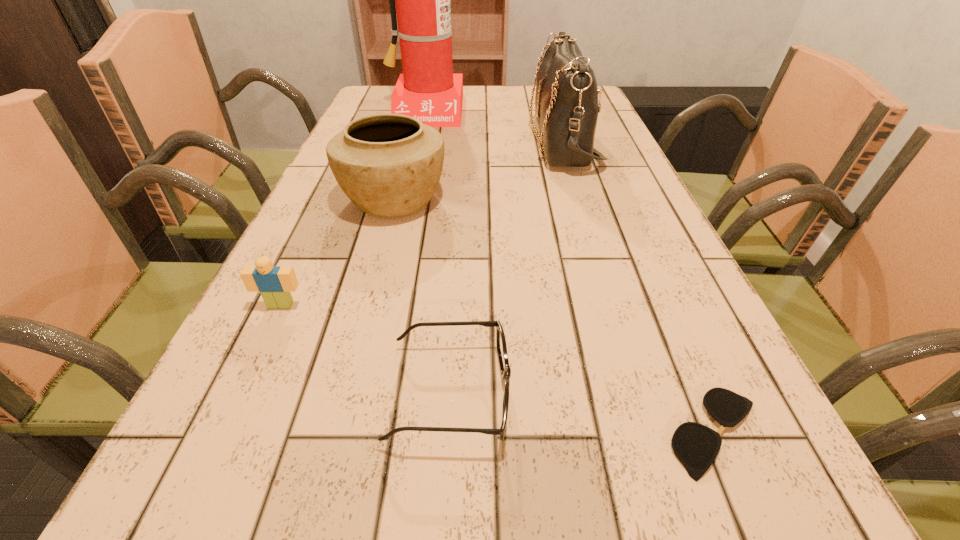
What are the coordinates of `free space located 0.350m at the front of the handbag with chain and zipper` in the screenshot? It's located at (402, 143).

Identify the location of free space located 0.380m at the front of the handbag with chain and zipper. (391, 143).

The width and height of the screenshot is (960, 540). What are the coordinates of `blank area located at the front of the handbag with chain and zipper` in the screenshot? It's located at (432, 143).

The width and height of the screenshot is (960, 540). I want to click on free space located 0.350m on the front of the pottery, so click(348, 372).

This screenshot has width=960, height=540. Identify the location of vacant space situated on the face of the Lego. (182, 515).

Image resolution: width=960 pixels, height=540 pixels. I want to click on free region located on the front-facing side of the left spectacles, so click(732, 393).

Locate an element on the screen. The image size is (960, 540). blank space located on the left of the shorter spectacles is located at coordinates (419, 433).

Image resolution: width=960 pixels, height=540 pixels. Identify the location of fire extinguisher at the far edge. (427, 90).

Where is `handbag that is positioned at the far edge`? The width and height of the screenshot is (960, 540). handbag that is positioned at the far edge is located at coordinates (566, 100).

At what (x,y) coordinates should I click in order to perform the action: click on fire extinguisher at the left edge. Please return your answer as a coordinate pair (x, y). Looking at the image, I should click on (427, 90).